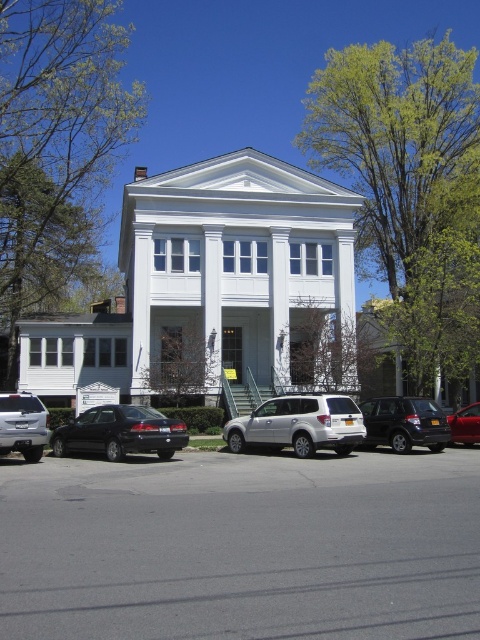
You are a delivery driver who needs to park your vehicle between the shiny black sedan at center and the metallic red sedan at center. Your van is 2.1 meters wide. Can you fit your van between them?

The shiny black sedan at center is wider than the metallic red sedan at center. Therefore, the space between them may vary depending on their exact positioning, but since the black sedan is wider, the gap might be sufficient for your van. However, without knowing the exact distance between the vehicles, it is uncertain if 2.1 meters will fit. You should measure the space first.

You are a delivery person trying to park your van between the shiny black sedan at center and the metallic red sedan at center. Which side should you park on to fit between them?

The shiny black sedan at center is positioned on the left side of metallic red sedan at center, so you should park on the right side of the shiny black sedan at center and left side of the metallic red sedan at center to fit between them.